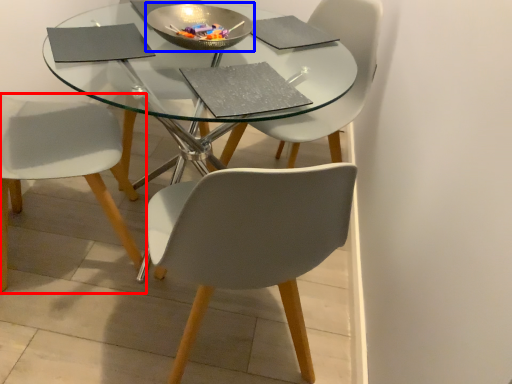
Question: Which point is closer to the camera, chair (highlighted by a red box) or bowl (highlighted by a blue box)?

Choices:
 (A) chair
 (B) bowl

Answer: (A)